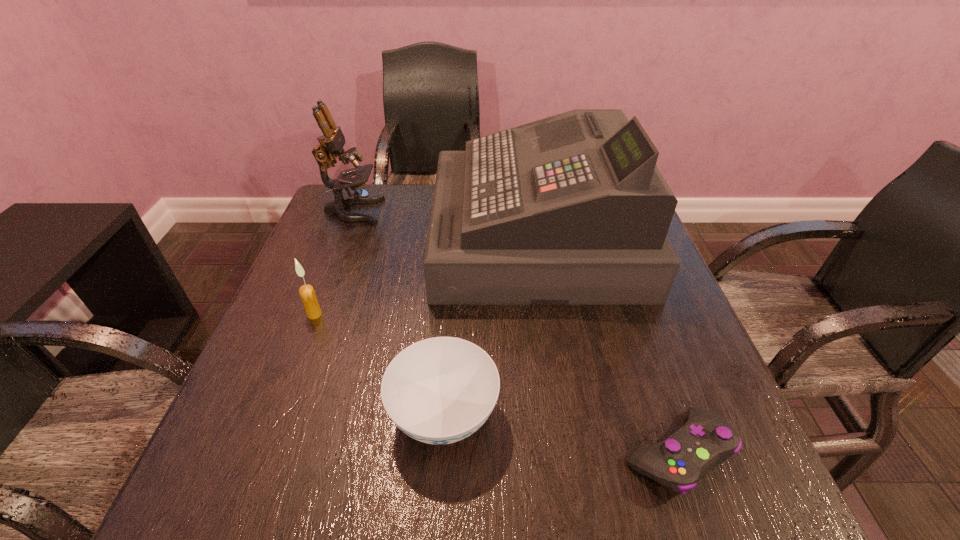
This screenshot has height=540, width=960. I want to click on control that is at the right edge, so click(x=705, y=441).

What are the coordinates of `object at the far left corner` in the screenshot? It's located at (332, 141).

Identify the location of object located in the far right corner section of the desktop. (571, 209).

Where is `object that is at the near right corner`? The image size is (960, 540). object that is at the near right corner is located at coordinates (705, 441).

Locate an element on the screen. vacant space at the far edge is located at coordinates (399, 206).

Where is `vacant region at the left edge of the desktop`? vacant region at the left edge of the desktop is located at coordinates (310, 342).

In the image, there is a desktop. Find the location of `free space at the right edge`. free space at the right edge is located at coordinates (700, 382).

Locate an element on the screen. This screenshot has height=540, width=960. blank space at the far left corner of the desktop is located at coordinates (383, 209).

Where is `blank region between the shortest object and the fourth tallest object`? blank region between the shortest object and the fourth tallest object is located at coordinates (560, 434).

The width and height of the screenshot is (960, 540). I want to click on empty location between the third shortest object and the microscope, so click(334, 263).